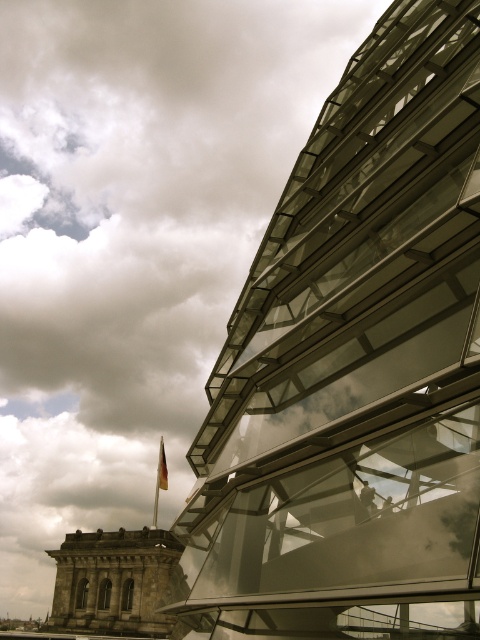
Is stone tower at lower left to the left of yellow fabric flag at lower left from the viewer's perspective?

Correct, you'll find stone tower at lower left to the left of yellow fabric flag at lower left.

From the picture: Can you confirm if stone tower at lower left is positioned to the right of yellow fabric flag at lower left?

No, stone tower at lower left is not to the right of yellow fabric flag at lower left.

Between point (137, 618) and point (160, 445), which one is positioned in front?

Point (137, 618) is more forward.

This screenshot has width=480, height=640. I want to click on stone tower at lower left, so click(112, 582).

Which is above, transparent glass tower at upper right or stone tower at lower left?

transparent glass tower at upper right is above.

The image size is (480, 640). What do you see at coordinates (354, 369) in the screenshot? I see `transparent glass tower at upper right` at bounding box center [354, 369].

Find the location of a particular element. This screenshot has width=480, height=640. transparent glass tower at upper right is located at coordinates (354, 369).

Is transparent glass tower at upper right behind yellow fabric flag at lower left?

No, it is in front of yellow fabric flag at lower left.

Is transparent glass tower at upper right smaller than yellow fabric flag at lower left?

Actually, transparent glass tower at upper right might be larger than yellow fabric flag at lower left.

Does point (310, 140) lie behind point (159, 458)?

No.

Find the location of a particular element. The image size is (480, 640). transparent glass tower at upper right is located at coordinates (354, 369).